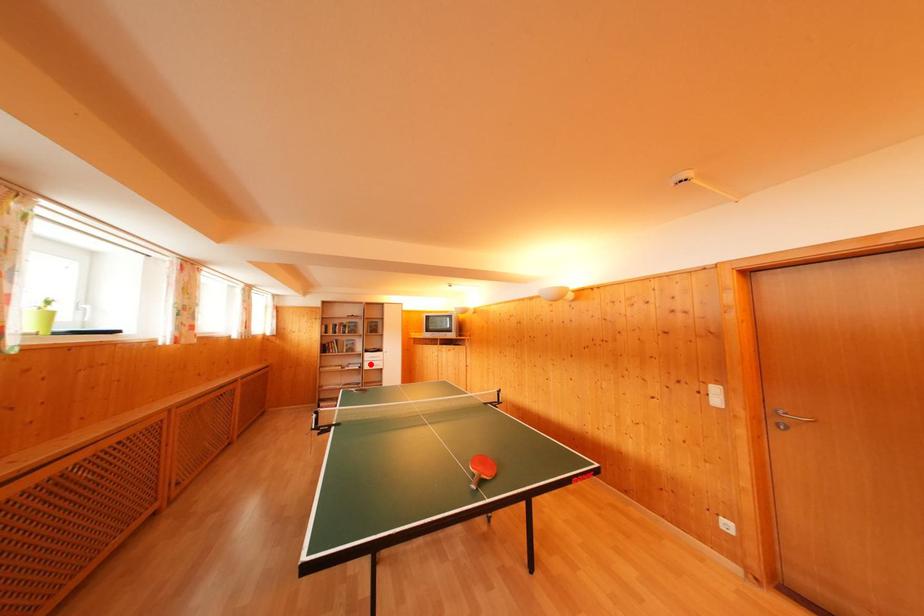
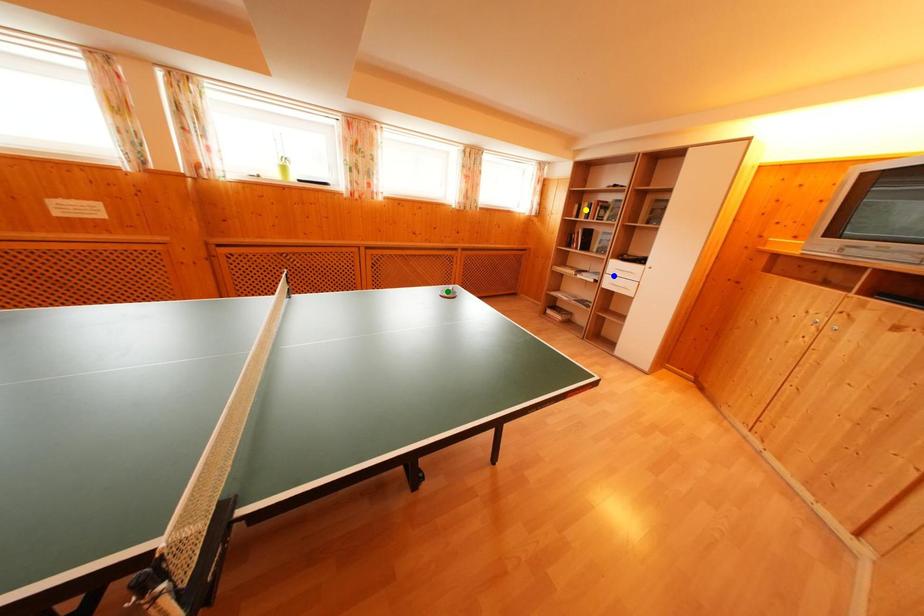
Question: I am providing you with two images of the same scene from different viewpoints. A red point is marked on the first image. You are given multiple points on the second image. In image 2, which mark is for the same physical point as the one in image 1?

Choices:
 (A) blue point
 (B) yellow point
 (C) green point

Answer: (A)